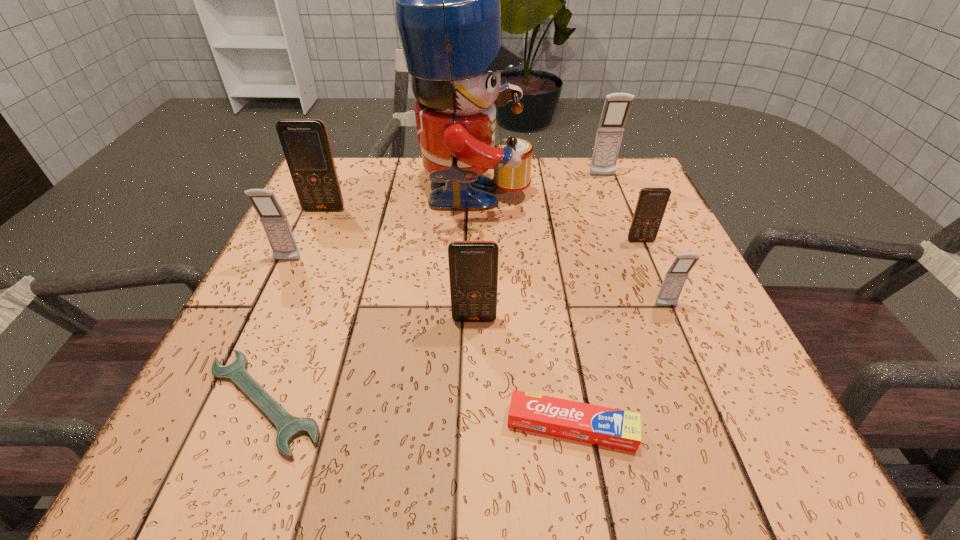
Locate an element on the screen. The width and height of the screenshot is (960, 540). blank region between the biggest orange cellular telephone and the nutcracker is located at coordinates (398, 206).

You are a GUI agent. You are given a task and a screenshot of the screen. Output one action in this format:
    pyautogui.click(x=<x>, y=<y>)
    Task: Click on the free space that is in between the blue nutcracker and the nearest gray cellular telephone
    This screenshot has width=960, height=540.
    Given the screenshot: What is the action you would take?
    pyautogui.click(x=569, y=254)

Find the location of a particular element. The image size is (960, 540). unoccupied position between the second farthest cellular telephone and the rightmost orange cellular telephone is located at coordinates (483, 225).

Image resolution: width=960 pixels, height=540 pixels. I want to click on free spot between the second farthest orange cellular telephone and the second farthest cellular telephone, so click(483, 225).

This screenshot has width=960, height=540. In order to click on vacant area that lies between the wrench and the fourth farthest cellular telephone in this screenshot , I will do `click(276, 331)`.

At what (x,y) coordinates should I click in order to perform the action: click on vacant point located between the tallest object and the toothpaste. Please return your answer as a coordinate pair (x, y). Image resolution: width=960 pixels, height=540 pixels. Looking at the image, I should click on (522, 314).

You are a GUI agent. You are given a task and a screenshot of the screen. Output one action in this format:
    pyautogui.click(x=<x>, y=<y>)
    Task: Click on the unoccupied area between the leftmost gray cellular telephone and the wrench
    This screenshot has width=960, height=540.
    Given the screenshot: What is the action you would take?
    pyautogui.click(x=276, y=331)

Where is `vacant area that lies between the eighth tallest object and the nutcracker`? The height and width of the screenshot is (540, 960). vacant area that lies between the eighth tallest object and the nutcracker is located at coordinates (522, 314).

Identify which object is the eighth nearest to the biggest orange cellular telephone. Please provide its 2D coordinates. Your answer should be formatted as a tuple, i.e. [(x, y)], where the tuple contains the x and y coordinates of a point satisfying the conditions above.

[(675, 278)]

Where is `object that is the second closest to the second orange cellular telephone from left to right`? Image resolution: width=960 pixels, height=540 pixels. object that is the second closest to the second orange cellular telephone from left to right is located at coordinates (289, 427).